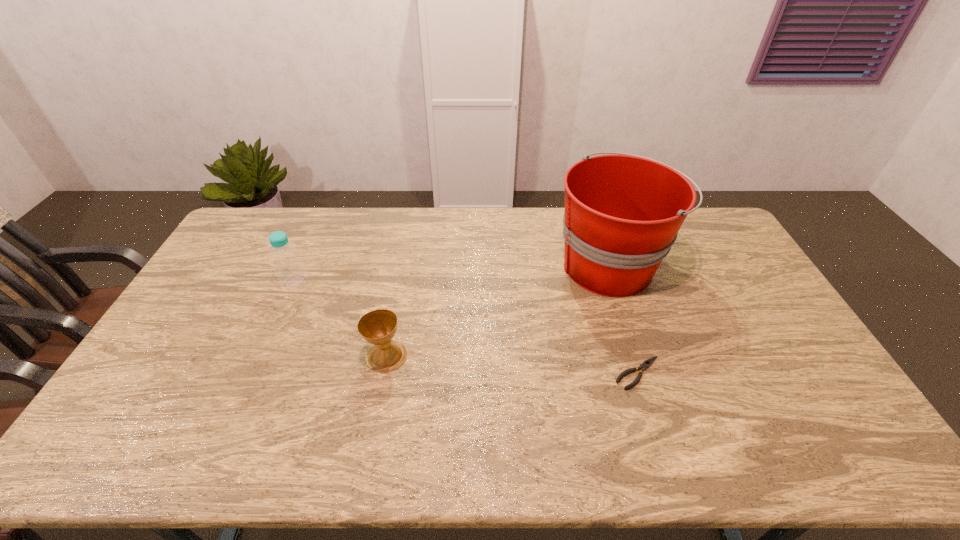
Where is `free space that satisfies the following two spatial constraints: 1. on the front side of the leftmost object; 2. on the right side of the third object from right to left`? The width and height of the screenshot is (960, 540). free space that satisfies the following two spatial constraints: 1. on the front side of the leftmost object; 2. on the right side of the third object from right to left is located at coordinates (262, 356).